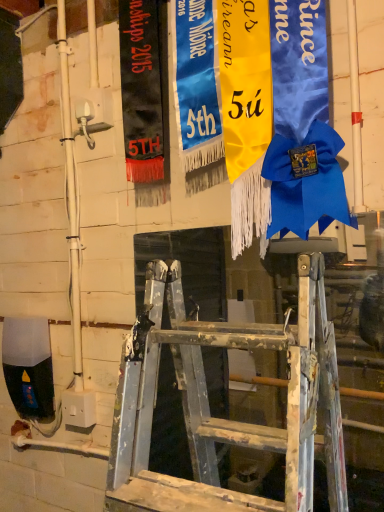
Question: Is blue satin ribbon at upper center, marked as the 2th tapestry in a right-to-left arrangement, directly adjacent to yellow satin ribbon at center, which ranks as the first tapestry in right-to-left order?

Choices:
 (A) yes
 (B) no

Answer: (A)

Question: From a real-world perspective, is blue satin ribbon at upper center, marked as the 2th tapestry in a right-to-left arrangement, located higher than yellow satin ribbon at center, which ranks as the first tapestry in right-to-left order?

Choices:
 (A) no
 (B) yes

Answer: (B)

Question: Is blue satin ribbon at upper center, marked as the second tapestry in a left-to-right arrangement, shorter than yellow satin ribbon at center, marked as the third tapestry in a left-to-right arrangement?

Choices:
 (A) no
 (B) yes

Answer: (B)

Question: Is the position of blue satin ribbon at upper center, marked as the 2th tapestry in a right-to-left arrangement, less distant than that of yellow satin ribbon at center, which ranks as the first tapestry in right-to-left order?

Choices:
 (A) yes
 (B) no

Answer: (B)

Question: Is blue satin ribbon at upper center, marked as the 2th tapestry in a right-to-left arrangement, oriented towards yellow satin ribbon at center, which ranks as the first tapestry in right-to-left order?

Choices:
 (A) no
 (B) yes

Answer: (A)

Question: Looking at their shapes, would you say black fabric banner at upper left, marked as the 1th tapestry in a left-to-right arrangement, is wider or thinner than blue satin ribbon at upper center, marked as the 2th tapestry in a right-to-left arrangement?

Choices:
 (A) wide
 (B) thin

Answer: (B)

Question: Is black fabric banner at upper left, marked as the 1th tapestry in a left-to-right arrangement, spatially inside blue satin ribbon at upper center, marked as the second tapestry in a left-to-right arrangement, or outside of it?

Choices:
 (A) inside
 (B) outside

Answer: (B)

Question: In terms of size, does black fabric banner at upper left, arranged as the 3th tapestry when viewed from the right, appear bigger or smaller than blue satin ribbon at upper center, marked as the second tapestry in a left-to-right arrangement?

Choices:
 (A) small
 (B) big

Answer: (A)

Question: Visually, is black fabric banner at upper left, marked as the 1th tapestry in a left-to-right arrangement, positioned to the left or to the right of blue satin ribbon at upper center, marked as the 2th tapestry in a right-to-left arrangement?

Choices:
 (A) left
 (B) right

Answer: (A)

Question: From the image's perspective, relative to yellow satin ribbon at center, marked as the third tapestry in a left-to-right arrangement, is black fabric banner at upper left, marked as the 1th tapestry in a left-to-right arrangement, above or below?

Choices:
 (A) above
 (B) below

Answer: (A)

Question: Considering the relative positions of black fabric banner at upper left, arranged as the 3th tapestry when viewed from the right, and yellow satin ribbon at center, marked as the third tapestry in a left-to-right arrangement, in the image provided, is black fabric banner at upper left, arranged as the 3th tapestry when viewed from the right, to the left or to the right of yellow satin ribbon at center, marked as the third tapestry in a left-to-right arrangement,?

Choices:
 (A) left
 (B) right

Answer: (A)

Question: Considering the positions of black fabric banner at upper left, arranged as the 3th tapestry when viewed from the right, and yellow satin ribbon at center, marked as the third tapestry in a left-to-right arrangement, in the image, is black fabric banner at upper left, arranged as the 3th tapestry when viewed from the right, wider or thinner than yellow satin ribbon at center, marked as the third tapestry in a left-to-right arrangement,?

Choices:
 (A) thin
 (B) wide

Answer: (A)

Question: In terms of size, does black fabric banner at upper left, arranged as the 3th tapestry when viewed from the right, appear bigger or smaller than yellow satin ribbon at center, which ranks as the first tapestry in right-to-left order?

Choices:
 (A) small
 (B) big

Answer: (A)

Question: Is blue satin ribbon at upper center, marked as the second tapestry in a left-to-right arrangement, bigger or smaller than yellow satin ribbon at center, marked as the third tapestry in a left-to-right arrangement?

Choices:
 (A) big
 (B) small

Answer: (B)

Question: Looking at their shapes, would you say blue satin ribbon at upper center, marked as the 2th tapestry in a right-to-left arrangement, is wider or thinner than yellow satin ribbon at center, marked as the third tapestry in a left-to-right arrangement?

Choices:
 (A) wide
 (B) thin

Answer: (B)